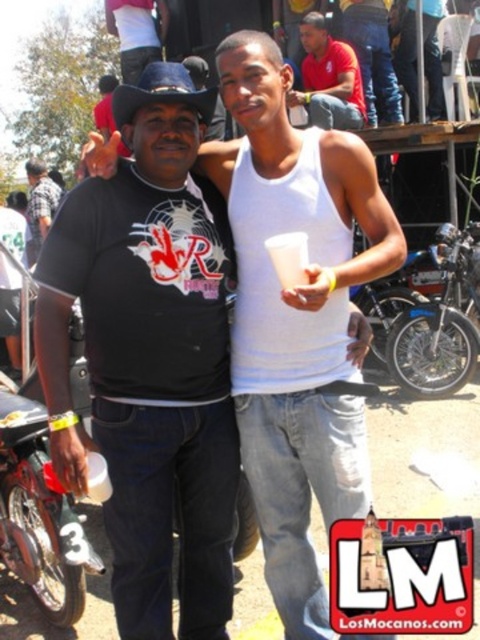
Does point (19, 419) come behind point (419, 378)?

No, it is not.

Where is `shiny black motorcycle at left`? This screenshot has width=480, height=640. shiny black motorcycle at left is located at coordinates (38, 513).

Is shiny black motorcycle at left bigger than matte red shirt at upper center?

Actually, shiny black motorcycle at left might be smaller than matte red shirt at upper center.

Is shiny black motorcycle at left taller than matte red shirt at upper center?

Incorrect, shiny black motorcycle at left's height is not larger of matte red shirt at upper center's.

You are a GUI agent. You are given a task and a screenshot of the screen. Output one action in this format:
    pyautogui.click(x=<x>, y=<y>)
    Task: Click on the shiny black motorcycle at left
    
    Given the screenshot: What is the action you would take?
    pyautogui.click(x=38, y=513)

Is point (267, 284) behind point (13, 534)?

No, it is not.

Between point (314, 312) and point (72, 512), which one is positioned behind?

The point (72, 512) is behind.

Between point (236, 349) and point (7, 493), which one is positioned in front?

Point (236, 349) is in front.

Find the location of a particular element. The width and height of the screenshot is (480, 640). matte black shirt at center is located at coordinates (296, 316).